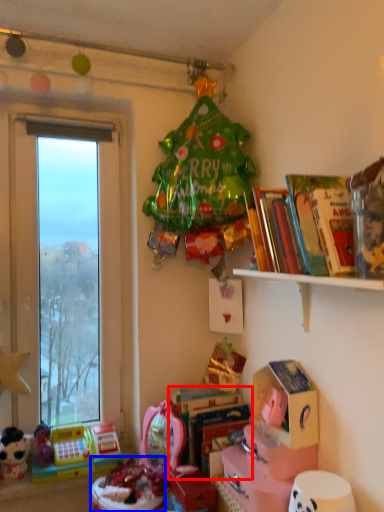
Question: Which object appears closest to the camera in this image, book (highlighted by a red box) or toy (highlighted by a blue box)?

Choices:
 (A) book
 (B) toy

Answer: (B)